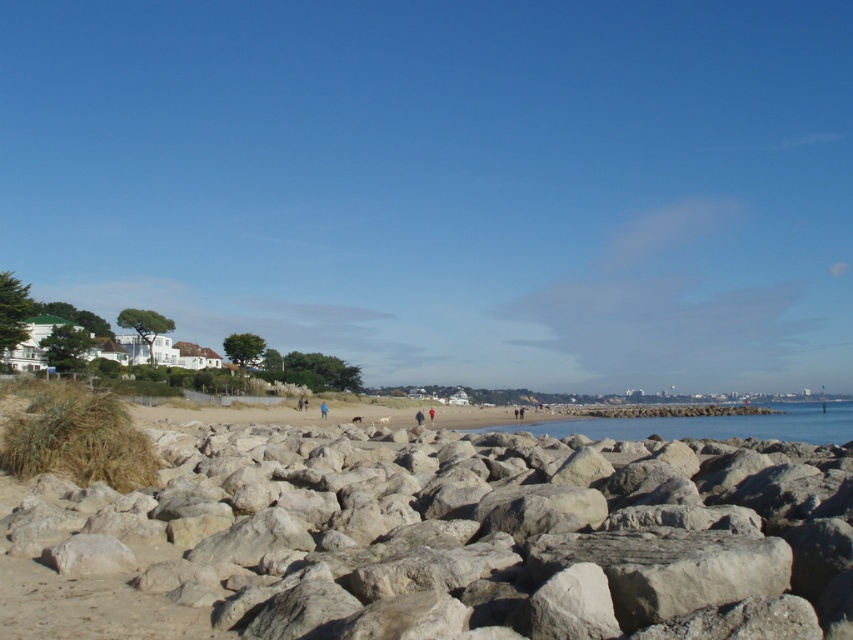
You are standing at the edge of the beach and want to place a small flag exactly at the center of the image. According to the coordinates provided, where should you place the flag relative to the smooth gray rocks at center?

The smooth gray rocks at center are already located at the center point of the image based on their coordinates at point [480,541]. Therefore, placing the flag at the center would mean placing it directly on top of the smooth gray rocks at center.